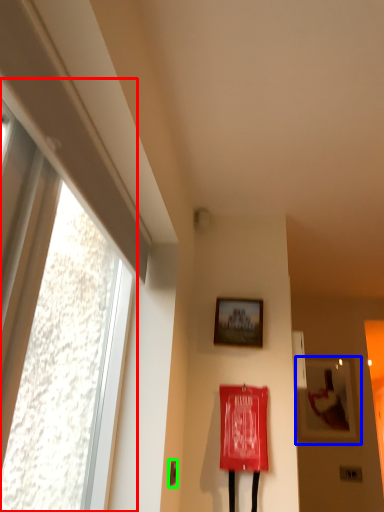
Question: Which is nearer to the window (highlighted by a red box)? picture frame (highlighted by a blue box) or door handle (highlighted by a green box).

Choices:
 (A) picture frame
 (B) door handle

Answer: (B)